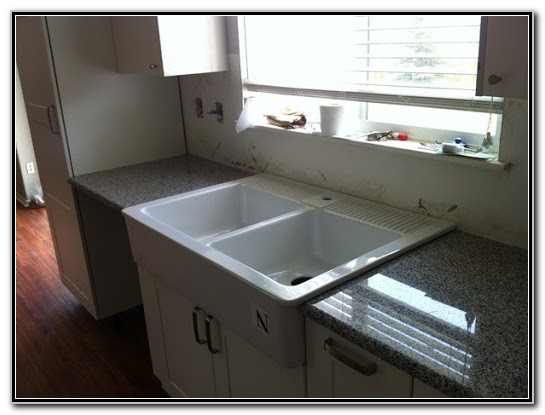
Find the location of a particular element. This screenshot has height=415, width=545. white electrical panel is located at coordinates (29, 168).